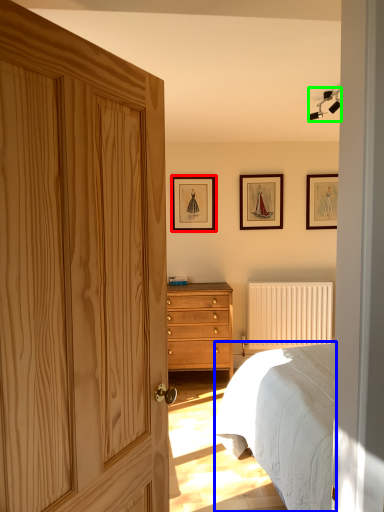
Question: Considering the real-world distances, which object is closest to picture frame (highlighted by a red box)? bed (highlighted by a blue box) or light fixture (highlighted by a green box).

Choices:
 (A) bed
 (B) light fixture

Answer: (B)